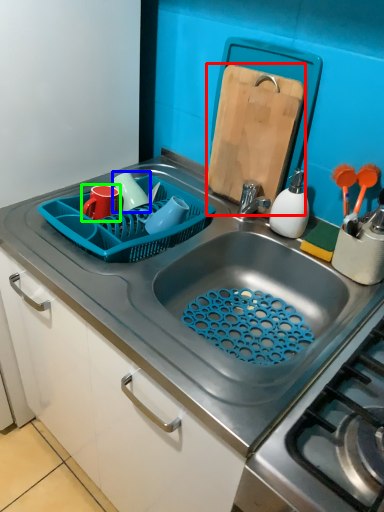
Question: Which object is the closest to the cutting board (highlighted by a red box)? Choose among these: tableware (highlighted by a blue box) or tableware (highlighted by a green box).

Choices:
 (A) tableware
 (B) tableware

Answer: (A)